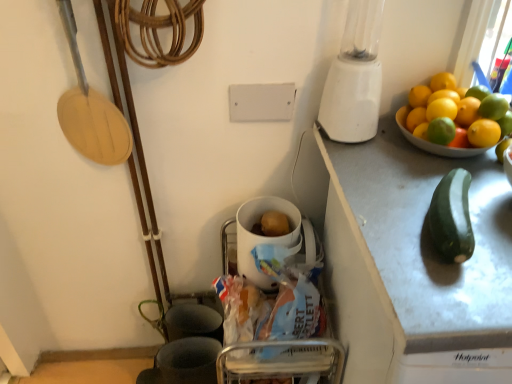
You are a GUI agent. You are given a task and a screenshot of the screen. Output one action in this format:
    pyautogui.click(x=<x>, y=<y>)
    Task: Click on the free space above white glossy mug at center (from a real-world perspective)
    The height and width of the screenshot is (384, 512).
    Given the screenshot: What is the action you would take?
    pyautogui.click(x=268, y=220)